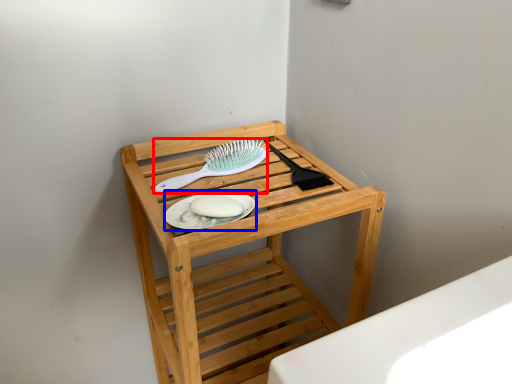
Question: Which point is further to the camera, brush (highlighted by a red box) or platter (highlighted by a blue box)?

Choices:
 (A) brush
 (B) platter

Answer: (A)